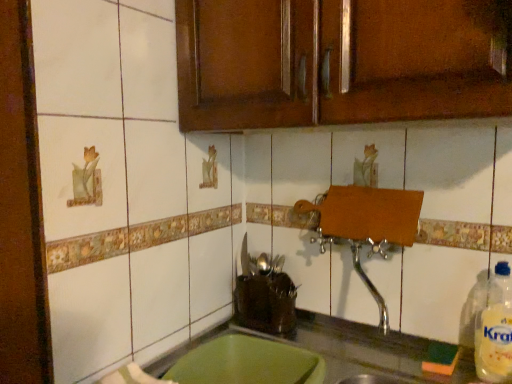
Question: Should I look upward or downward to see clear plastic bottle at right?

Choices:
 (A) up
 (B) down

Answer: (B)

Question: Is clear plastic bottle at right to the right of green plastic tray at lower center from the viewer's perspective?

Choices:
 (A) no
 (B) yes

Answer: (B)

Question: Is clear plastic bottle at right shorter than green plastic tray at lower center?

Choices:
 (A) no
 (B) yes

Answer: (A)

Question: Is green plastic tray at lower center at the back of clear plastic bottle at right?

Choices:
 (A) no
 (B) yes

Answer: (A)

Question: Is clear plastic bottle at right closer to the viewer compared to green plastic tray at lower center?

Choices:
 (A) no
 (B) yes

Answer: (A)

Question: Is clear plastic bottle at right taller than green plastic tray at lower center?

Choices:
 (A) yes
 (B) no

Answer: (A)

Question: From the image's perspective, is clear plastic bottle at right beneath green plastic tray at lower center?

Choices:
 (A) no
 (B) yes

Answer: (A)

Question: Can you confirm if green plastic tray at lower center is wider than brown wood cabinet at upper center?

Choices:
 (A) no
 (B) yes

Answer: (B)

Question: From the image's perspective, is green plastic tray at lower center above brown wood cabinet at upper center?

Choices:
 (A) no
 (B) yes

Answer: (A)

Question: Could you tell me if green plastic tray at lower center is facing brown wood cabinet at upper center?

Choices:
 (A) no
 (B) yes

Answer: (A)

Question: Are green plastic tray at lower center and brown wood cabinet at upper center far apart?

Choices:
 (A) yes
 (B) no

Answer: (B)

Question: Can you confirm if green plastic tray at lower center is shorter than brown wood cabinet at upper center?

Choices:
 (A) no
 (B) yes

Answer: (B)

Question: Is brown wood cabinet at upper center located within green plastic tray at lower center?

Choices:
 (A) no
 (B) yes

Answer: (A)

Question: Considering the relative sizes of green plastic tray at lower center and clear plastic bottle at right in the image provided, is green plastic tray at lower center taller than clear plastic bottle at right?

Choices:
 (A) yes
 (B) no

Answer: (B)